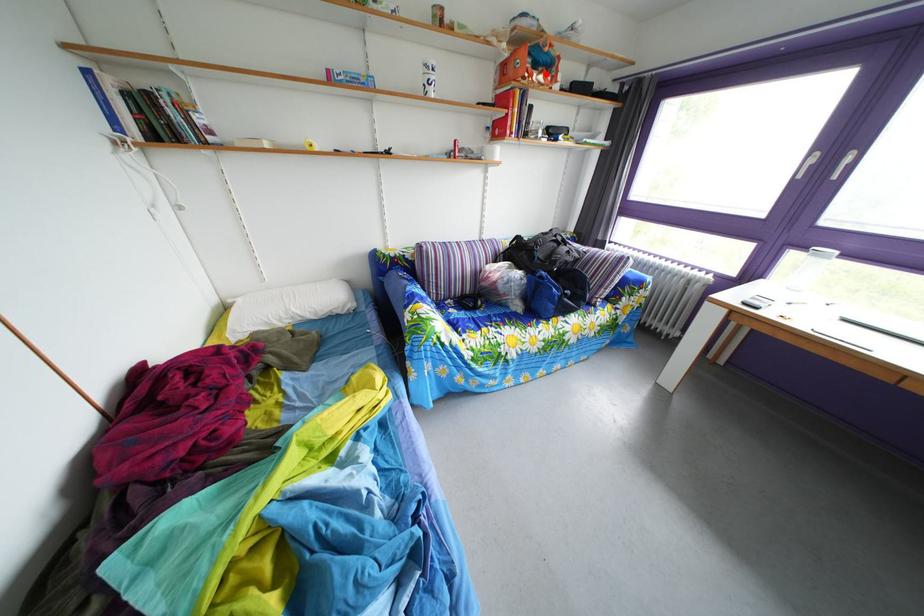
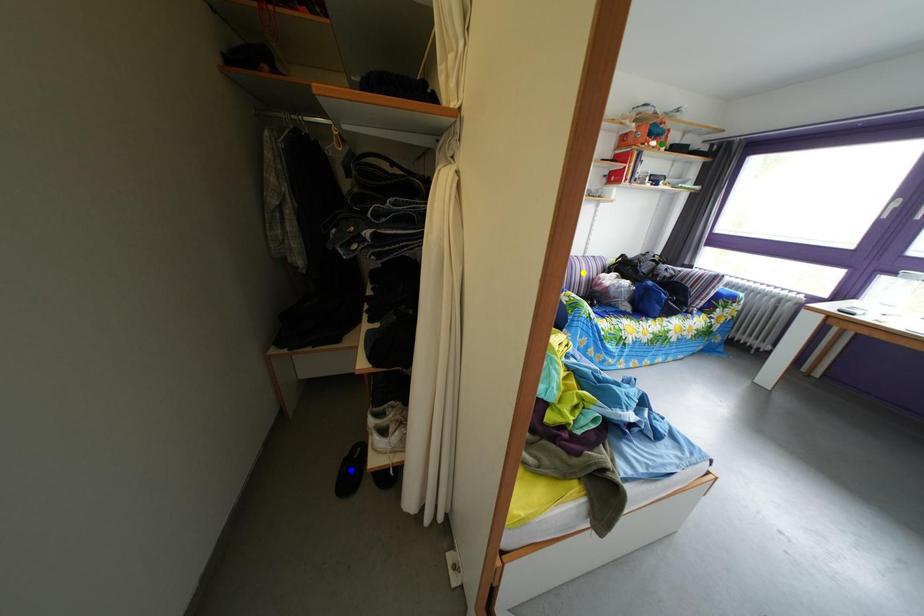
Question: I am providing you with two images of the same scene from different viewpoints. A red point is marked on the first image. You are given multiple points on the second image. Which point in image 2 is actually the same real-world point as the red point in image 1?

Choices:
 (A) yellow point
 (B) green point
 (C) blue point

Answer: (B)